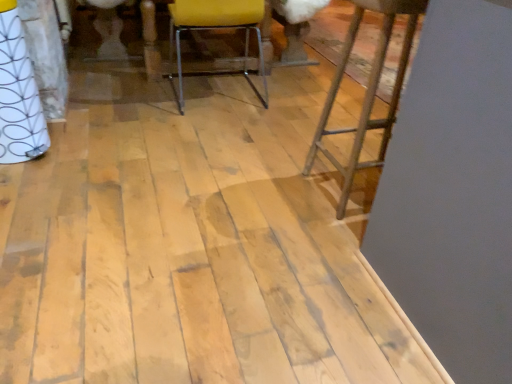
Find the location of a particular element. This screenshot has width=512, height=384. vacant space to the right of yellow fabric chair at center is located at coordinates (292, 103).